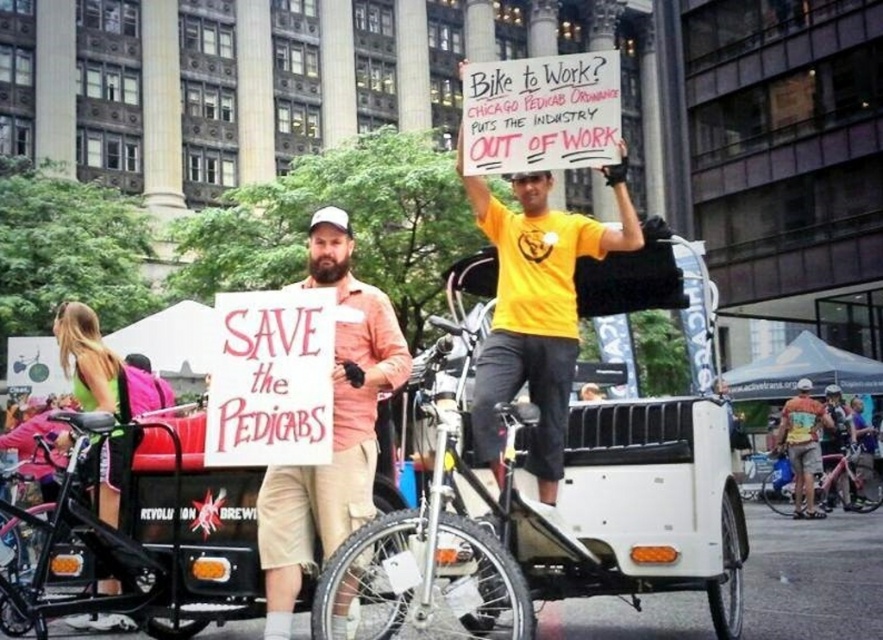
Question: Which point is farther to the camera?

Choices:
 (A) beige cotton shorts at center
 (B) yellow matte shirt at center
 (C) green fabric backpack at left
 (D) metallic silver camera at center

Answer: (D)

Question: Is beige cotton shorts at center thinner than camouflage fabric shorts at center?

Choices:
 (A) no
 (B) yes

Answer: (A)

Question: Where is green fabric backpack at left located in relation to silver metallic bicycle at center in the image?

Choices:
 (A) left
 (B) right

Answer: (A)

Question: Which object appears closest to the camera in this image?

Choices:
 (A) yellow matte shirt at center
 (B) silver metallic bicycle at center
 (C) camouflage fabric shorts at center

Answer: (A)

Question: Which point appears closest to the camera in this image?

Choices:
 (A) (333, 518)
 (B) (839, 490)
 (C) (561, 454)

Answer: (A)

Question: Can you confirm if yellow matte shirt at center is thinner than beige cotton shorts at center?

Choices:
 (A) no
 (B) yes

Answer: (B)